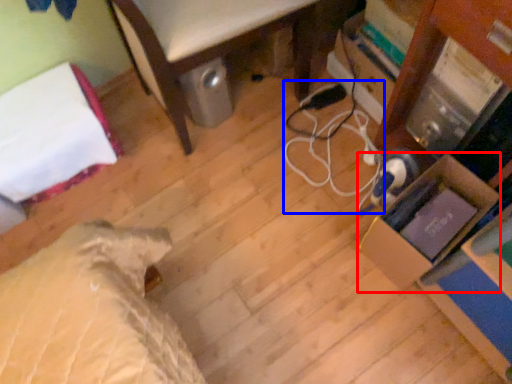
Question: Among these objects, which one is nearest to the camera, cardboard box (highlighted by a red box) or cable (highlighted by a blue box)?

Choices:
 (A) cardboard box
 (B) cable

Answer: (A)